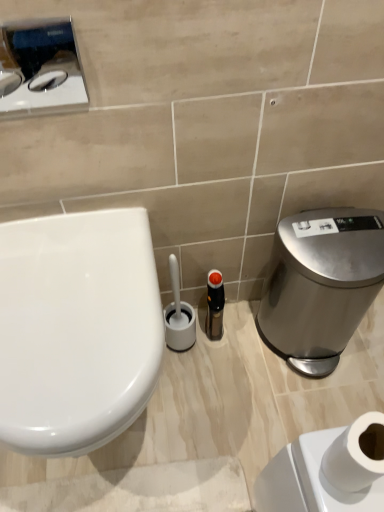
Question: Should I look upward or downward to see satin silver trash can at right?

Choices:
 (A) up
 (B) down

Answer: (B)

Question: Does black plastic bottle at center turn towards brushed metal toilet paper dispenser at upper left?

Choices:
 (A) yes
 (B) no

Answer: (B)

Question: Can you confirm if black plastic bottle at center is wider than brushed metal toilet paper dispenser at upper left?

Choices:
 (A) yes
 (B) no

Answer: (A)

Question: Does black plastic bottle at center have a lesser height compared to brushed metal toilet paper dispenser at upper left?

Choices:
 (A) no
 (B) yes

Answer: (A)

Question: Could brushed metal toilet paper dispenser at upper left be considered to be inside black plastic bottle at center?

Choices:
 (A) yes
 (B) no

Answer: (B)

Question: Is black plastic bottle at center positioned behind brushed metal toilet paper dispenser at upper left?

Choices:
 (A) no
 (B) yes

Answer: (B)

Question: Is black plastic bottle at center turned away from brushed metal toilet paper dispenser at upper left?

Choices:
 (A) yes
 (B) no

Answer: (B)

Question: From a real-world perspective, is black plastic bottle at center physically below satin silver trash can at right?

Choices:
 (A) yes
 (B) no

Answer: (A)

Question: Is black plastic bottle at center smaller than satin silver trash can at right?

Choices:
 (A) no
 (B) yes

Answer: (B)

Question: Does black plastic bottle at center appear on the right side of satin silver trash can at right?

Choices:
 (A) yes
 (B) no

Answer: (B)

Question: Does black plastic bottle at center have a lesser width compared to satin silver trash can at right?

Choices:
 (A) yes
 (B) no

Answer: (A)

Question: Is black plastic bottle at center touching satin silver trash can at right?

Choices:
 (A) yes
 (B) no

Answer: (B)

Question: From a real-world perspective, is black plastic bottle at center physically above satin silver trash can at right?

Choices:
 (A) no
 (B) yes

Answer: (A)

Question: Does brushed metal toilet paper dispenser at upper left turn towards satin silver trash can at right?

Choices:
 (A) yes
 (B) no

Answer: (B)